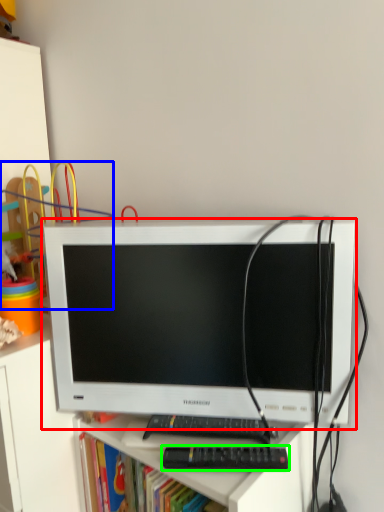
Question: Which object is positioned closest to computer monitor (highlighted by a red box)? Select from toy (highlighted by a blue box) and control (highlighted by a green box).

Choices:
 (A) toy
 (B) control

Answer: (B)